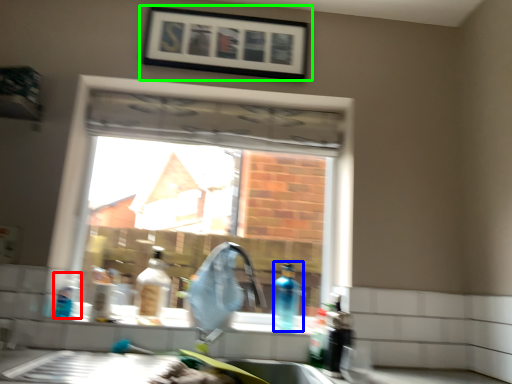
Question: Considering the real-world distances, which object is farthest from bottle (highlighted by a red box)? bottle (highlighted by a blue box) or picture frame (highlighted by a green box)?

Choices:
 (A) bottle
 (B) picture frame

Answer: (B)